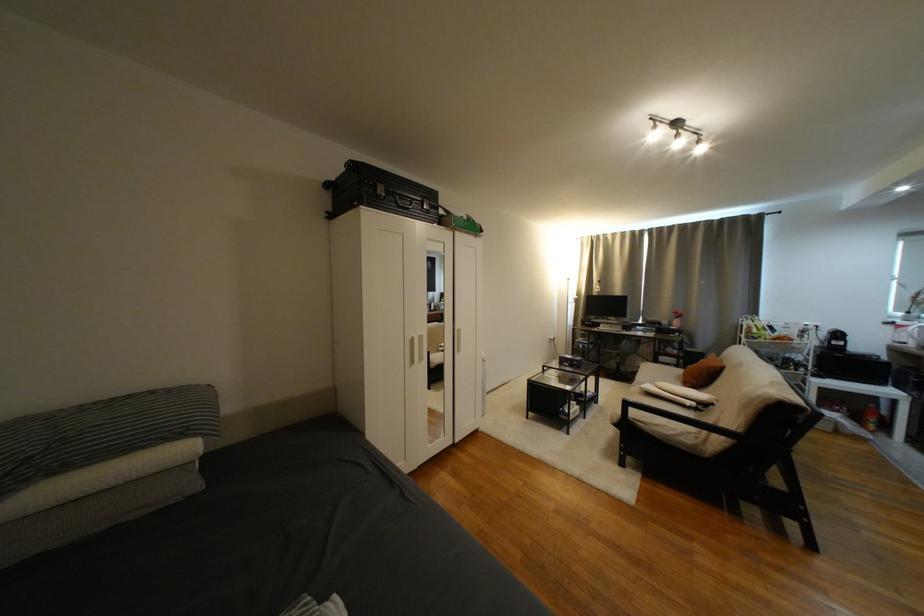
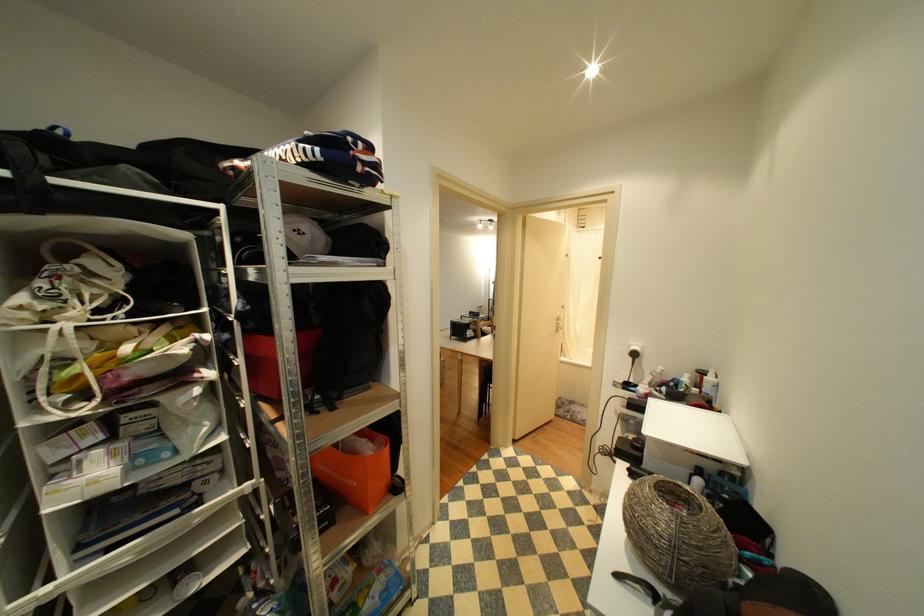
Question: The images are taken continuously from a first-person perspective. In which direction are you moving?

Choices:
 (A) Left
 (B) Right
 (C) Forward
 (D) Backward

Answer: (D)